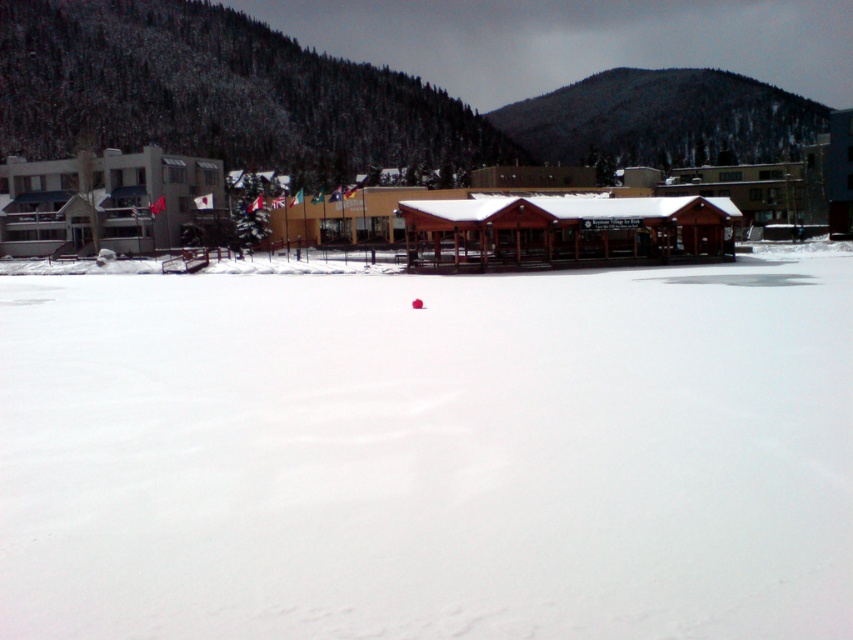
Between point (296, 230) and point (677, 227), which one is positioned behind?

The point (296, 230) is more distant.

Consider the image. Can you confirm if brown wooden ski resort at center is shorter than wooden hut at center?

No, brown wooden ski resort at center is not shorter than wooden hut at center.

Does point (19, 176) come behind point (648, 253)?

Yes, it is behind point (648, 253).

This screenshot has height=640, width=853. I want to click on brown wooden ski resort at center, so click(496, 216).

Is white snow at center further to camera compared to brown wooden ski resort at center?

No.

Which is behind, point (39, 628) or point (701, 234)?

Point (701, 234)

Is point (73, 324) positioned before point (486, 193)?

Yes, it is in front of point (486, 193).

Find the location of `white snow at center`. white snow at center is located at coordinates (428, 452).

Is point (271, 214) farther from viewer compared to point (149, 228)?

Yes, it is behind point (149, 228).

Can you confirm if brown wooden ski resort at center is positioned to the left of matte gray building at left?

Incorrect, brown wooden ski resort at center is not on the left side of matte gray building at left.

Is point (480, 212) less distant than point (32, 216)?

Yes, it is.

Locate an element on the screen. brown wooden ski resort at center is located at coordinates (496, 216).